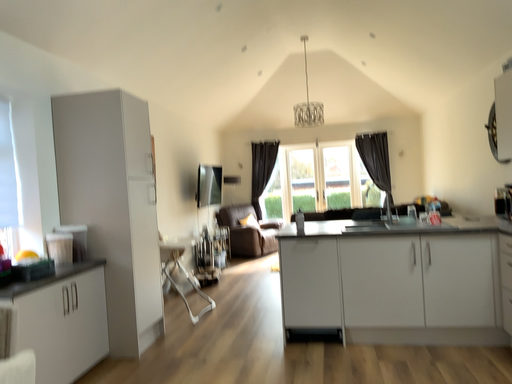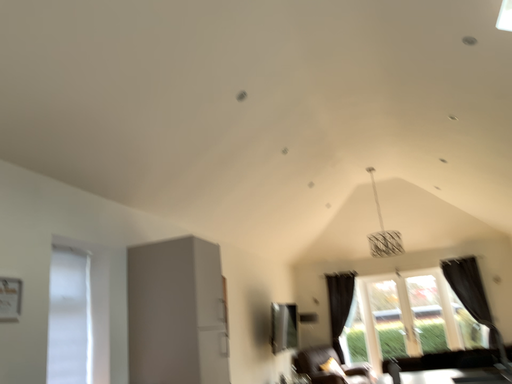
Question: Which way did the camera rotate in the video?

Choices:
 (A) rotated upward
 (B) rotated downward

Answer: (A)